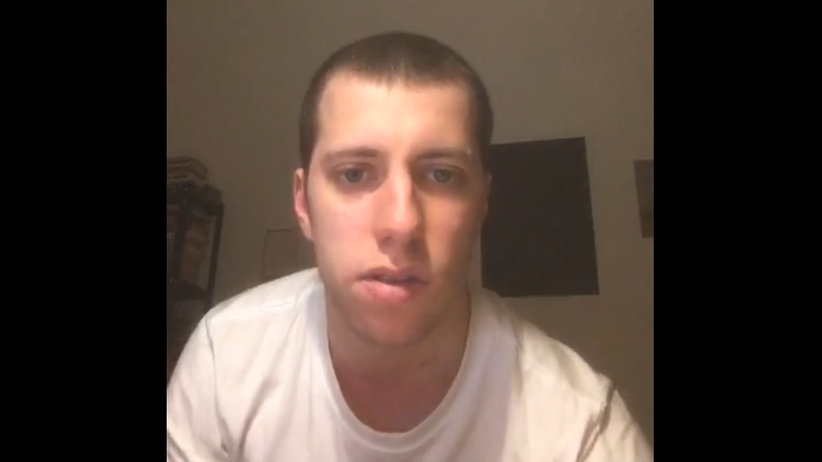
Identify the location of shelf. The height and width of the screenshot is (462, 822). tap(200, 292).